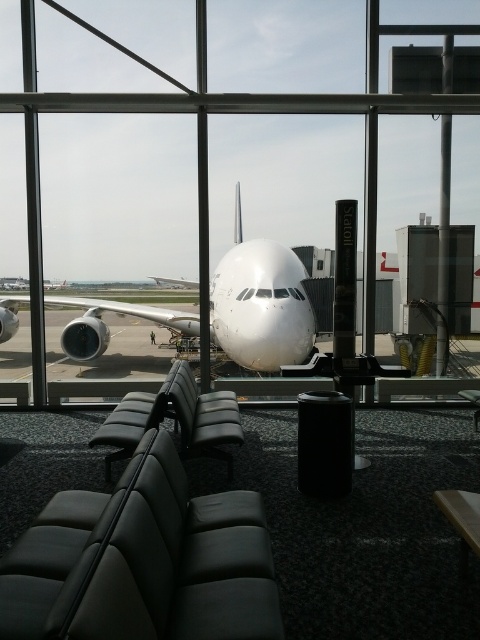
You are standing in the airport terminal and want to take a photo of the white glossy airplane at center through the large glass windows. Based on the scene description, where should you position yourself to ensure the airplane is centered in your photo?

To center the white glossy airplane at center in your photo, position yourself directly in front of the point at coordinates 0.475 on the x axis and 0.544 on the y axis relative to the window frame.

You are a passenger sitting in the leather seat at center and want to take a photo of the white glossy airplane at center through the window. Considering the height of both objects, will the top of the airplane be fully visible in your photo?

The white glossy airplane at center is not as tall as the leather seat at center, so the top of the airplane will be fully visible in the photo.

You are sitting in the black leather chair at center and want to look out the window to see the white glossy airplane at center. Which direction should you turn your head?

The white glossy airplane at center is positioned on the left side of the black leather chair at center, so you should turn your head to the left to see it.